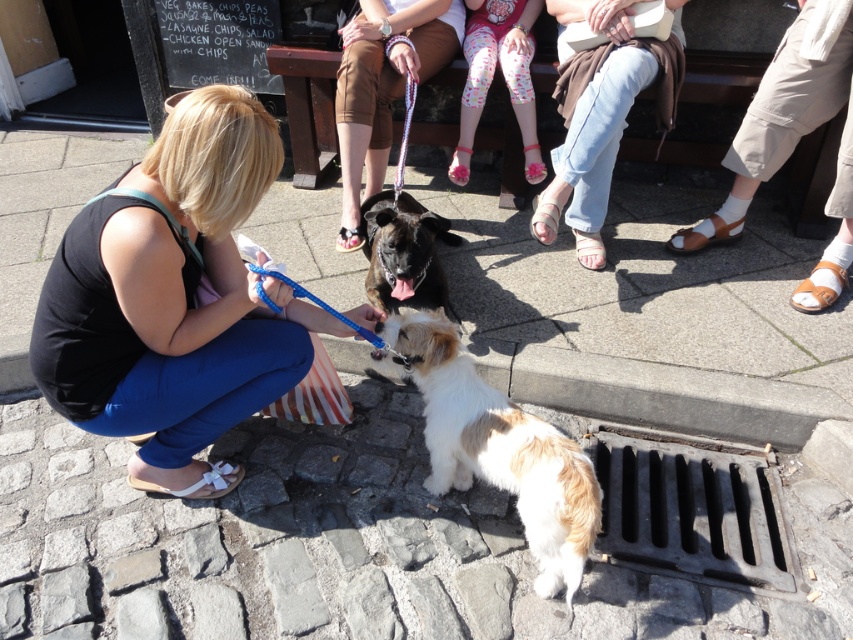
Question: Which point is closer to the camera taking this photo?

Choices:
 (A) (399, 196)
 (B) (583, 182)
 (C) (392, 337)

Answer: (C)

Question: Does black fabric at lower left appear under brown fur dog at center?

Choices:
 (A) no
 (B) yes

Answer: (B)

Question: Which point is farther from the camera taking this photo?

Choices:
 (A) (584, 154)
 (B) (184, 132)
 (C) (437, 403)
 (D) (367, 211)

Answer: (D)

Question: Does light blue denim jeans at center lie in front of brown fur dog at center?

Choices:
 (A) yes
 (B) no

Answer: (B)

Question: Which is nearer to the light blue denim jeans at center?

Choices:
 (A) white-furred dog at lower center
 (B) black fabric at lower left

Answer: (A)

Question: Can you confirm if white-furred dog at lower center is positioned above brown fur dog at center?

Choices:
 (A) yes
 (B) no

Answer: (B)